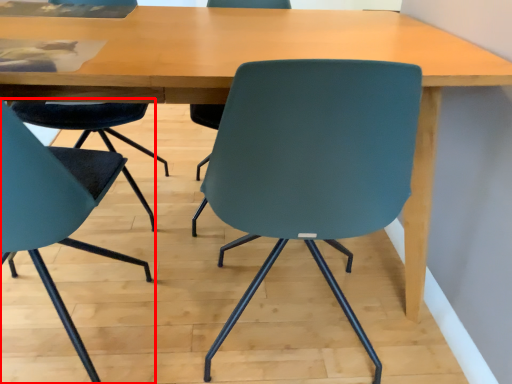
Question: In this image, where is chair (annotated by the red box) located relative to chair?

Choices:
 (A) right
 (B) left

Answer: (B)